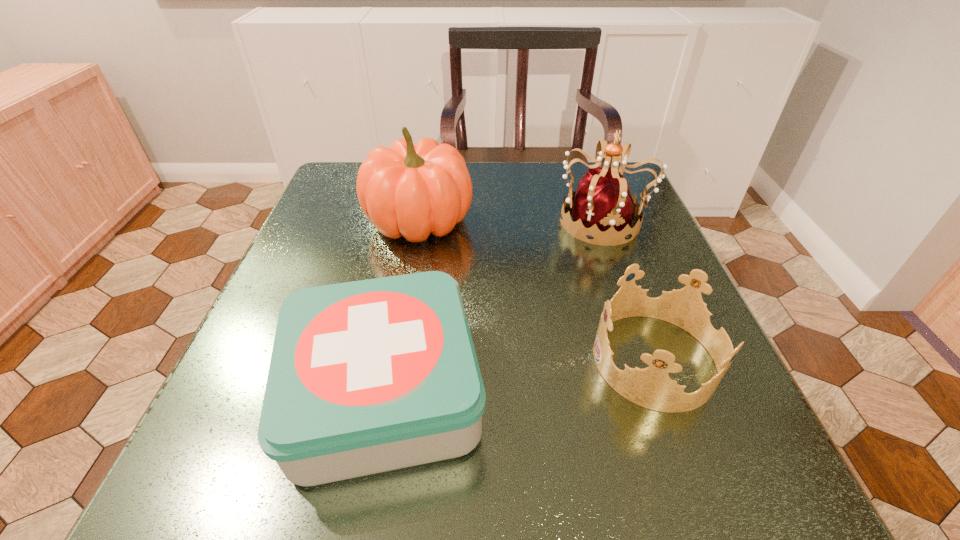
Where is `free space between the shorter tiara and the pumpkin`? free space between the shorter tiara and the pumpkin is located at coordinates (537, 290).

What are the coordinates of `free space between the pumpkin and the taller tiara` in the screenshot? It's located at (512, 221).

The height and width of the screenshot is (540, 960). I want to click on free space between the nearer tiara and the first-aid kit, so click(x=519, y=376).

At what (x,y) coordinates should I click in order to perform the action: click on free space between the shorter tiara and the first-aid kit. Please return your answer as a coordinate pair (x, y). Image resolution: width=960 pixels, height=540 pixels. Looking at the image, I should click on (519, 376).

Identify the location of object that stands as the second closest to the farther tiara. This screenshot has width=960, height=540. (411, 191).

Locate an element on the screen. object that is the third closest to the taller tiara is located at coordinates (369, 376).

This screenshot has width=960, height=540. I want to click on vacant space that satisfies the following two spatial constraints: 1. on the front-facing side of the taller tiara; 2. on the front side of the first-aid kit, so click(665, 392).

The width and height of the screenshot is (960, 540). Find the location of `free region that satisfies the following two spatial constraints: 1. on the front-facing side of the nearer tiara; 2. on the front side of the first-aid kit`. free region that satisfies the following two spatial constraints: 1. on the front-facing side of the nearer tiara; 2. on the front side of the first-aid kit is located at coordinates (666, 392).

Find the location of `free space in the image that satisfies the following two spatial constraints: 1. on the front-facing side of the nearer tiara; 2. on the front side of the first-aid kit`. free space in the image that satisfies the following two spatial constraints: 1. on the front-facing side of the nearer tiara; 2. on the front side of the first-aid kit is located at coordinates (666, 392).